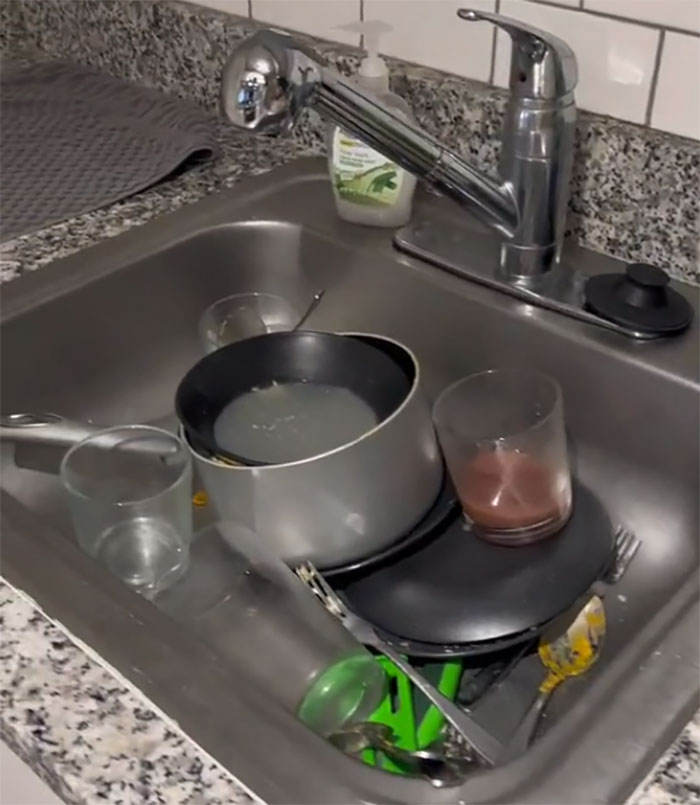
You are a GUI agent. You are given a task and a screenshot of the screen. Output one action in this format:
    pyautogui.click(x=<x>, y=<y>)
    Task: Click on the backsplash
    The height and width of the screenshot is (805, 700).
    Given the screenshot: What is the action you would take?
    pyautogui.click(x=314, y=15)